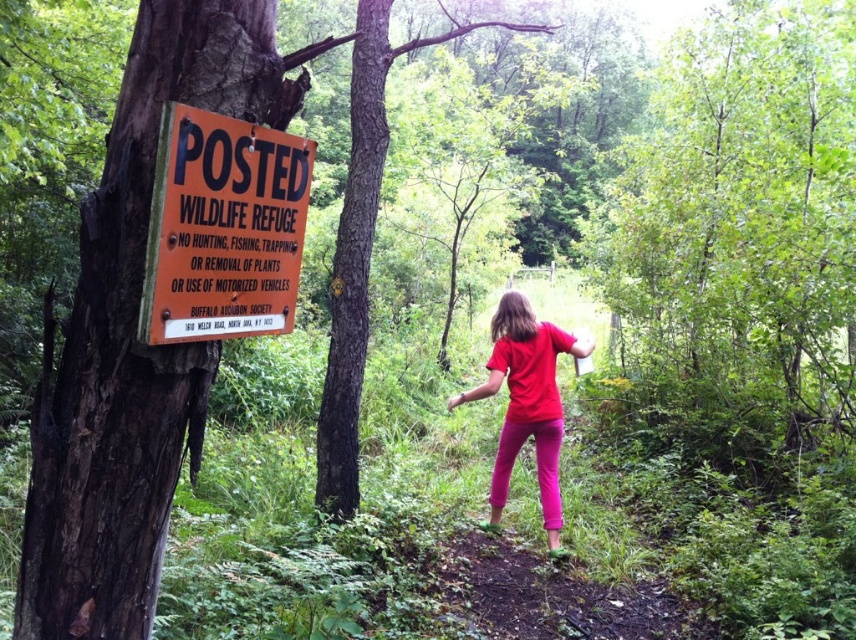
Question: Among these points, which one is nearest to the camera?

Choices:
 (A) (490, 381)
 (B) (238, 128)

Answer: (B)

Question: Which of the following is the farthest from the observer?

Choices:
 (A) (271, 134)
 (B) (556, 554)

Answer: (B)

Question: Can you confirm if orange paper sign at left is smaller than matte red shirt at center?

Choices:
 (A) yes
 (B) no

Answer: (A)

Question: Does orange paper sign at left have a smaller size compared to matte red shirt at center?

Choices:
 (A) yes
 (B) no

Answer: (A)

Question: Is orange paper sign at left wider than matte red shirt at center?

Choices:
 (A) yes
 (B) no

Answer: (B)